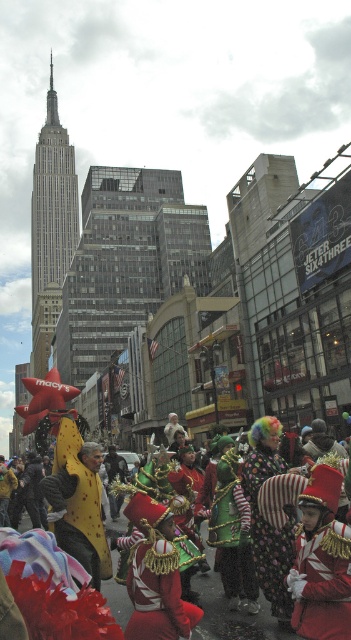
You are a photographer standing in the middle of the street, and you want to take a photo that includes both point A at point (x=313, y=616) and point B at point (x=254, y=472). Which point should you focus on first to ensure both are in the frame?

You should focus on point A at point (x=313, y=616) first because it is closer to you than point B at point (x=254, y=472). By focusing on the closer point, you can ensure that both points remain in the frame.

You are a photographer trying to capture the shiny red uniform at center and the shiny metallic costume at center in a single shot. Based on their positions, which one is closer to the camera?

The shiny red uniform at center is positioned over the shiny metallic costume at center, meaning it is closer to the camera.